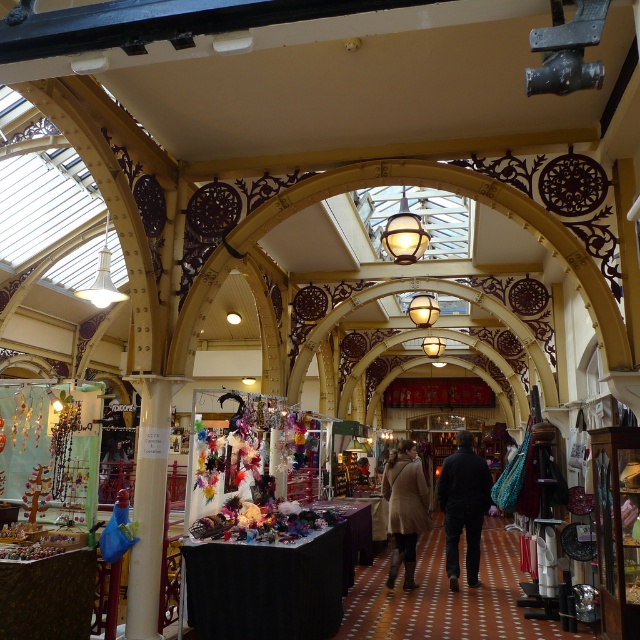
Is dark blue jeans at center to the right of beige wool coat at center from the viewer's perspective?

Yes, dark blue jeans at center is to the right of beige wool coat at center.

Which is behind, point (442, 476) or point (397, 467)?

The point (442, 476) is behind.

You are a GUI agent. You are given a task and a screenshot of the screen. Output one action in this format:
    pyautogui.click(x=<x>, y=<y>)
    Task: Click on the dark blue jeans at center
    This screenshot has width=640, height=640.
    Given the screenshot: What is the action you would take?
    pyautogui.click(x=464, y=506)